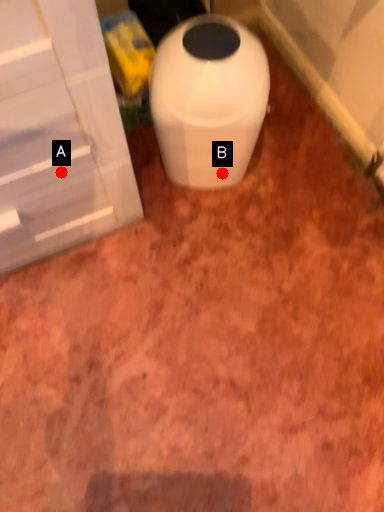
Question: Two points are circled on the image, labeled by A and B beside each circle. Which point is farther to the camera?

Choices:
 (A) A is further
 (B) B is further

Answer: (B)